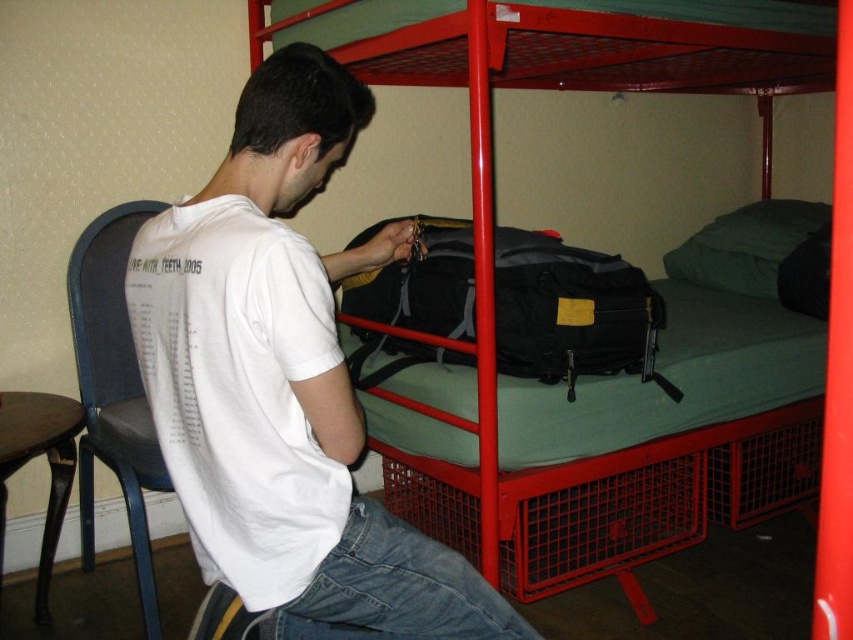
You are trying to decide whether to place a new rectangular storage box between the black fabric backpack at center and the brown wood stool at lower left. The storage box is 1.2 meters wide. Based on the scene description, will the storage box fit horizontally between them?

The black fabric backpack at center is wider than the brown wood stool at lower left. Since the storage box is 1.2 meters wide, it depends on the actual distance between them. However, the description only states the backpack is wider, not the exact spacing. Without knowing the exact gap, we cannot confirm if the storage box will fit.